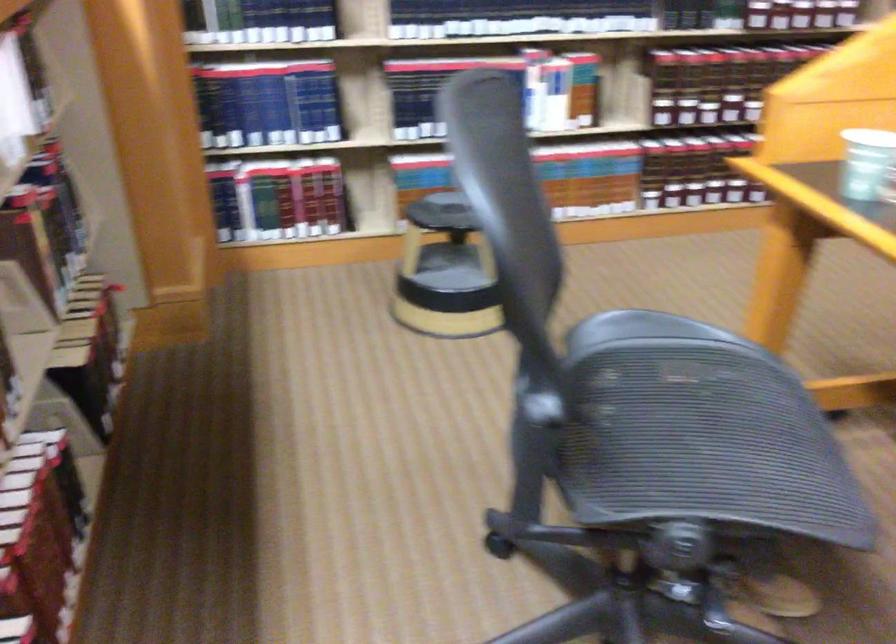
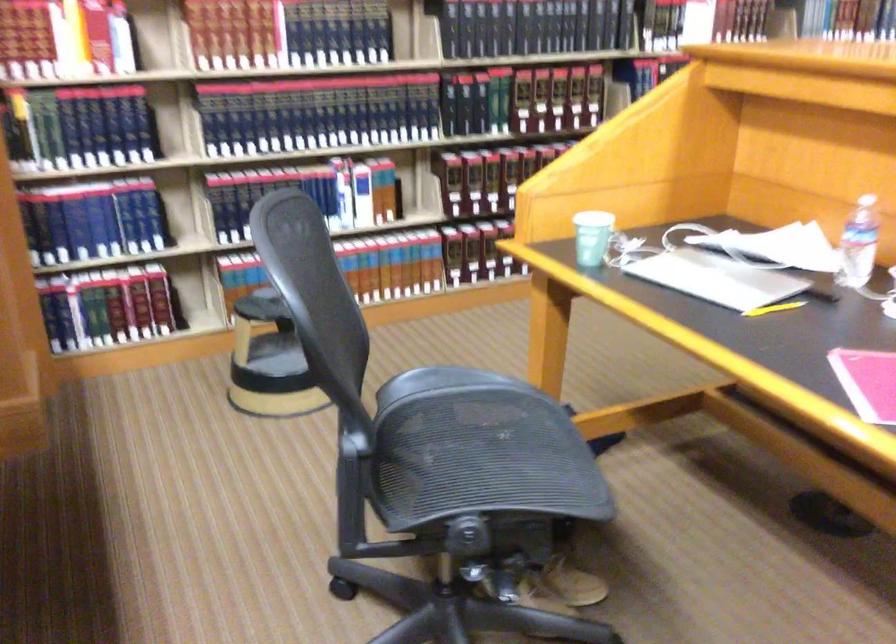
The point at (720,79) is marked in the first image. Where is the corresponding point in the second image?

(488, 176)